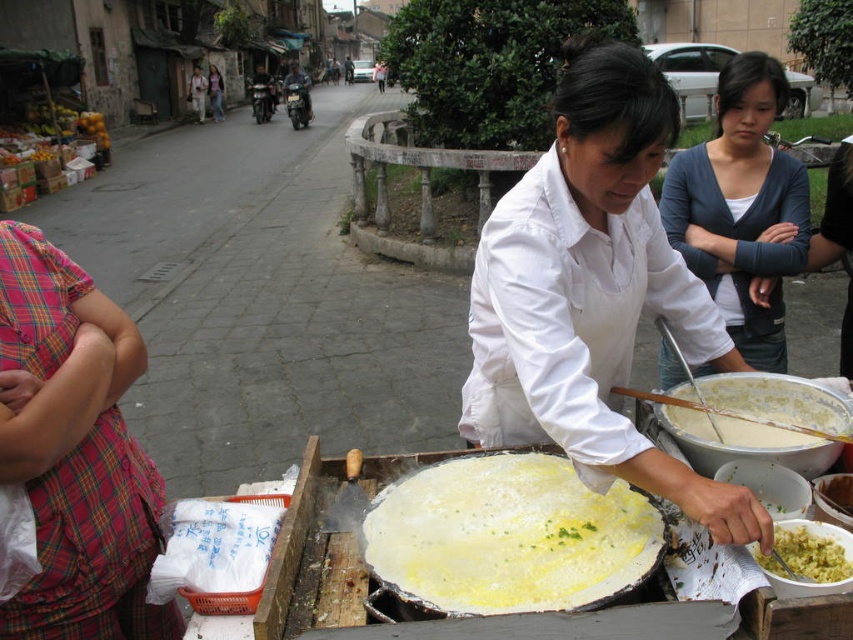
Does white creamy batter at lower right appear under matte white shirt at center?

Yes.

Between white creamy batter at lower right and matte white shirt at center, which one is positioned higher?

Positioned higher is matte white shirt at center.

Does point (679, 406) lie in front of point (212, 83)?

Yes, point (679, 406) is closer to viewer.

At what (x,y) coordinates should I click in order to perform the action: click on white creamy batter at lower right. Please return your answer as a coordinate pair (x, y). Looking at the image, I should click on (758, 412).

The image size is (853, 640). What do you see at coordinates (740, 208) in the screenshot?
I see `dark gray sweater at center` at bounding box center [740, 208].

What do you see at coordinates (740, 208) in the screenshot? The height and width of the screenshot is (640, 853). I see `dark gray sweater at center` at bounding box center [740, 208].

Locate an element on the screen. This screenshot has height=640, width=853. dark gray sweater at center is located at coordinates (740, 208).

Is dark gray sweater at center thinner than white creamy batter at lower right?

No.

Who is lower down, dark gray sweater at center or white creamy batter at lower right?

white creamy batter at lower right

Find the location of a particular element. This screenshot has height=640, width=853. dark gray sweater at center is located at coordinates (740, 208).